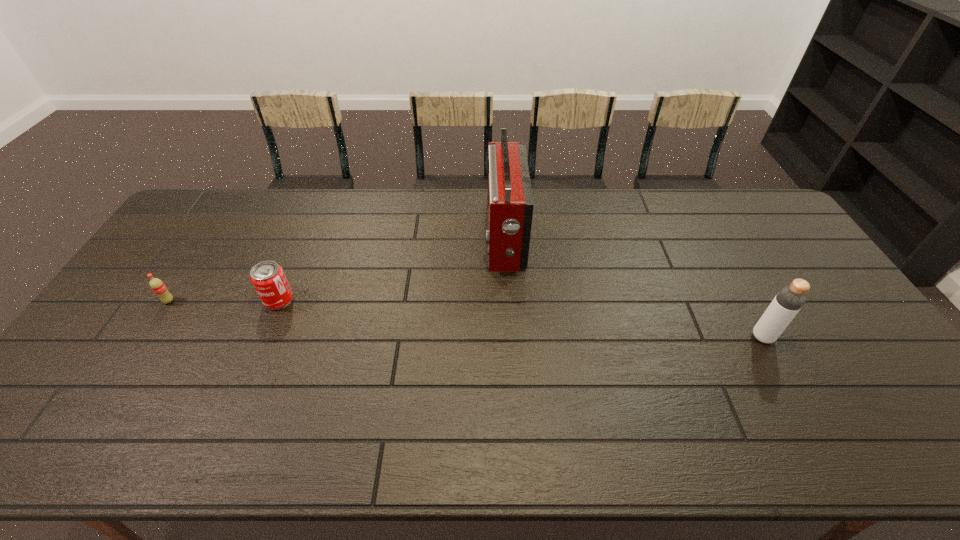
You are a GUI agent. You are given a task and a screenshot of the screen. Output one action in this format:
    pyautogui.click(x=<x>, y=<y>)
    Task: Click on the second object from right to left
    The image size is (960, 540).
    Given the screenshot: What is the action you would take?
    pyautogui.click(x=510, y=202)

Find the location of `the tallest object`. the tallest object is located at coordinates (510, 202).

Find the location of a particular element. The width and height of the screenshot is (960, 540). the nearest object is located at coordinates (787, 303).

In order to click on the rightmost object in this screenshot , I will do point(787,303).

Where is `can`? Image resolution: width=960 pixels, height=540 pixels. can is located at coordinates (268, 278).

Locate an element on the screen. The image size is (960, 540). soda is located at coordinates (158, 287).

The width and height of the screenshot is (960, 540). Find the location of `vacant space situated 0.220m on the front-facing side of the third object from left to right`. vacant space situated 0.220m on the front-facing side of the third object from left to right is located at coordinates (420, 239).

In order to click on free spot located 0.320m on the front-facing side of the third object from left to right in this screenshot , I will do `click(389, 239)`.

I want to click on vacant space located 0.360m on the front-facing side of the third object from left to right, so click(377, 239).

Where is `vacant space located on the right of the rightmost object`? Image resolution: width=960 pixels, height=540 pixels. vacant space located on the right of the rightmost object is located at coordinates (852, 337).